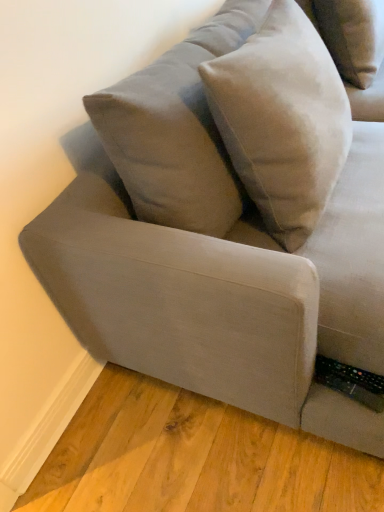
Question: From a real-world perspective, is suede-like beige pillow at upper right positioned above or below suede beige pillow at upper center?

Choices:
 (A) above
 (B) below

Answer: (B)

Question: Based on their positions, is suede-like beige pillow at upper right located to the left or right of suede beige pillow at upper center?

Choices:
 (A) right
 (B) left

Answer: (A)

Question: Is suede-like beige pillow at upper right in front of or behind suede beige pillow at upper center in the image?

Choices:
 (A) behind
 (B) front

Answer: (A)

Question: Visually, is suede beige pillow at upper center positioned to the left or to the right of suede-like beige pillow at upper right?

Choices:
 (A) right
 (B) left

Answer: (B)

Question: Considering their positions, is suede beige pillow at upper center located in front of or behind suede-like beige pillow at upper right?

Choices:
 (A) front
 (B) behind

Answer: (A)

Question: From a real-world perspective, is suede beige pillow at upper center positioned above or below suede-like beige pillow at upper right?

Choices:
 (A) above
 (B) below

Answer: (A)

Question: Is suede beige pillow at upper center wider or thinner than suede-like beige pillow at upper right?

Choices:
 (A) thin
 (B) wide

Answer: (A)